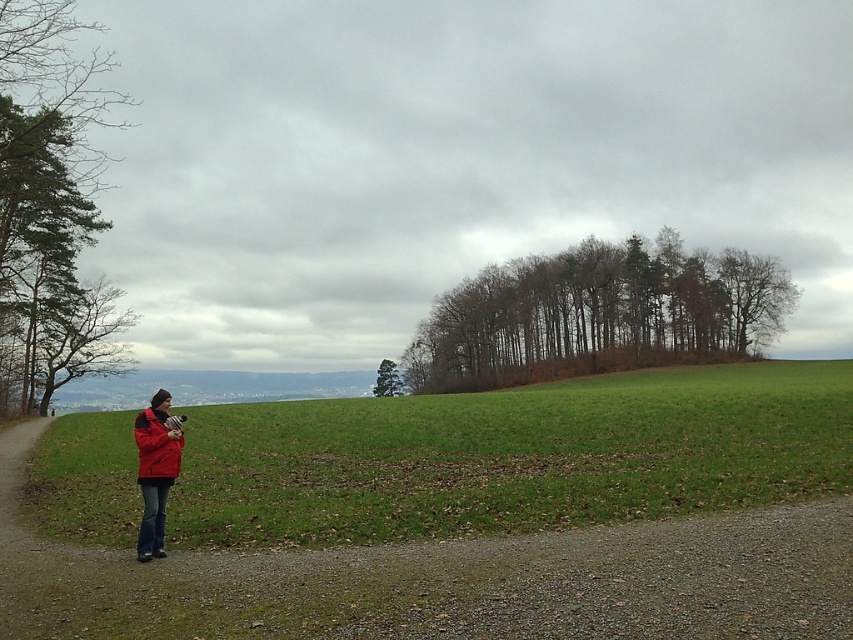
You are standing at the center of the gravel path in the image. Which direction should you walk to reach the green grassy field at lower left?

The green grassy field at lower left is located at point coordinates that are to the left side of the path, so you should walk towards the left direction from the center of the gravel path to reach it.

You are planning to place a 150 feet long fence between the green grassy field at lower left and the green matte tree at center. Is there enough space to fit the fence between them?

The distance between the green grassy field at lower left and the green matte tree at center is 200.51 feet, so yes, the fence can be placed between them as the distance is greater than the fence length.

You are a hiker standing on the gravel path and want to take a photo of the green leafy tree at left without the brown leafy trees at center blocking the view. Is this possible?

The green leafy tree at left is behind the brown leafy trees at center, so it would be blocked by them. Therefore, it is not possible to take a photo of the green leafy tree at left without the brown leafy trees at center blocking the view.